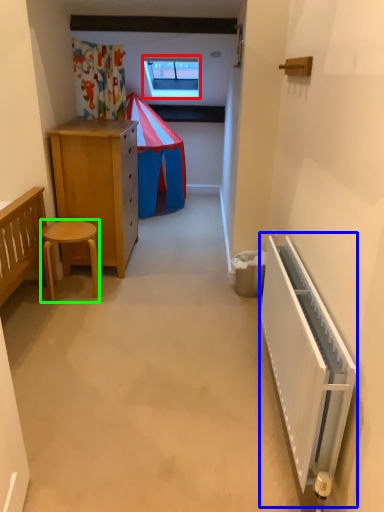
Question: Which object is the closest to the window (highlighted by a red box)? Choose among these: radiator (highlighted by a blue box) or stool (highlighted by a green box).

Choices:
 (A) radiator
 (B) stool

Answer: (B)